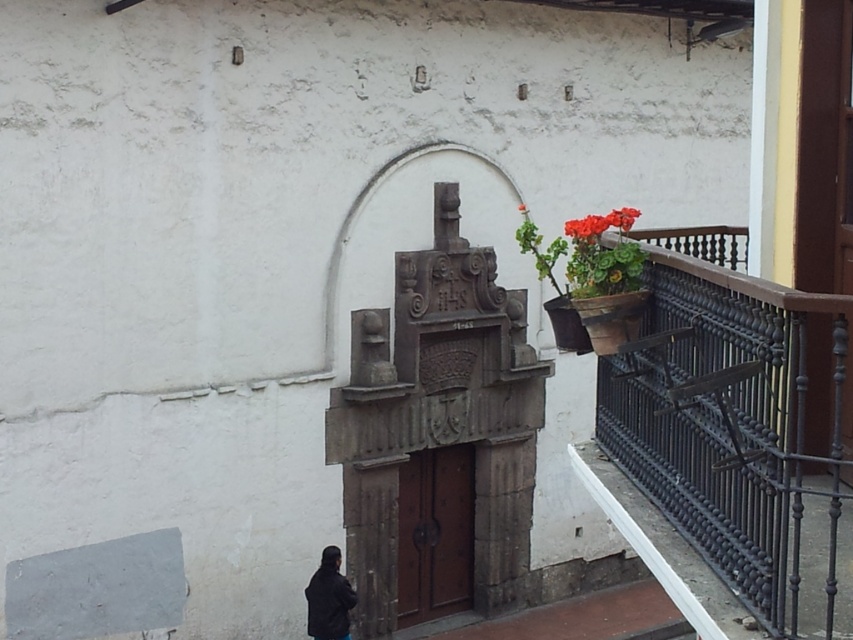
You are standing in front of the building and want to touch both points mentioned. Which point should you reach for first, the point at coordinate (309,621) or the point at coordinate (585,237)?

You should reach for the point at coordinate (309,621) first because it is closer to you than the point at coordinate (585,237).

From the picture: You are a painter standing at the base of the building and want to paint both the black wrought iron railing at right and the red matte flower at upper center. Your ladder can reach up to 3.5 feet. Can you paint both objects without moving the ladder?

The black wrought iron railing at right and red matte flower at upper center are 4.00 feet apart, so the ladder cannot reach both objects without moving it since its maximum reach is 3.5 feet.